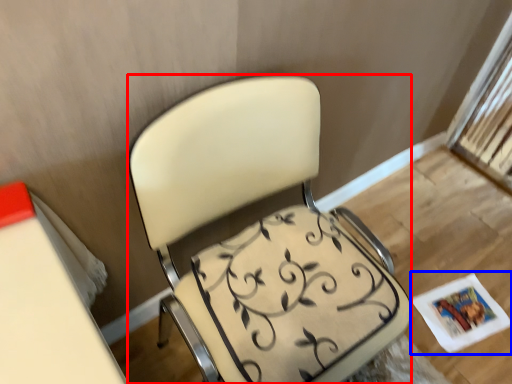
Question: Which of the following is the farthest to the observer, chair (highlighted by a red box) or magazine (highlighted by a blue box)?

Choices:
 (A) chair
 (B) magazine

Answer: (B)